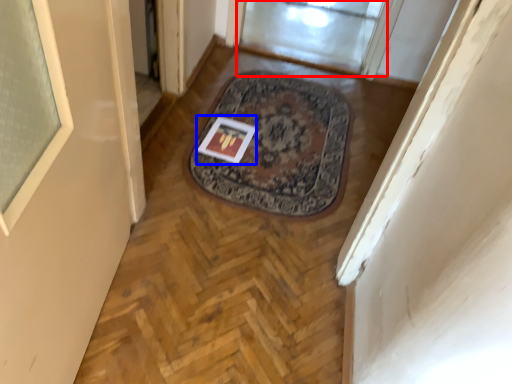
Question: Among these objects, which one is farthest to the camera, window screen (highlighted by a red box) or postcard (highlighted by a blue box)?

Choices:
 (A) window screen
 (B) postcard

Answer: (A)